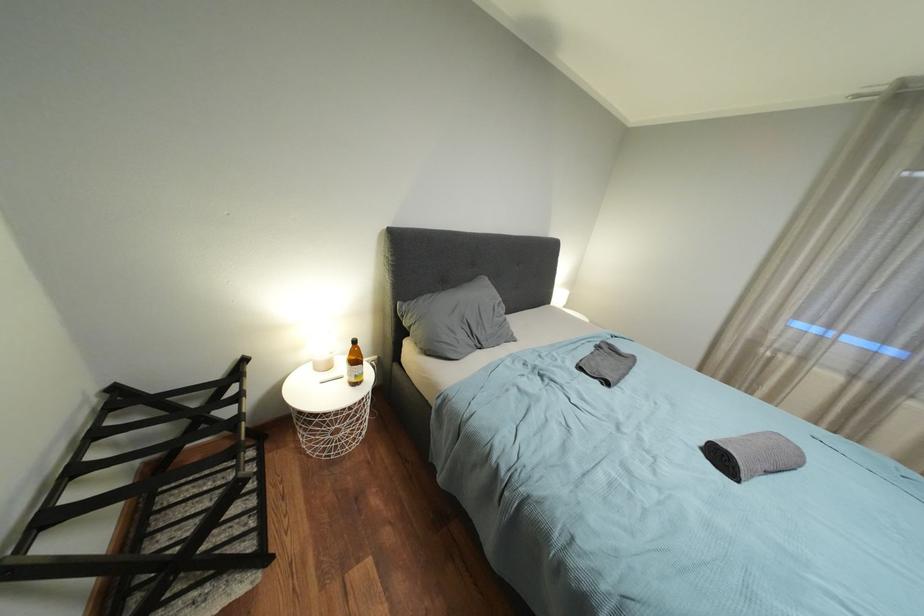
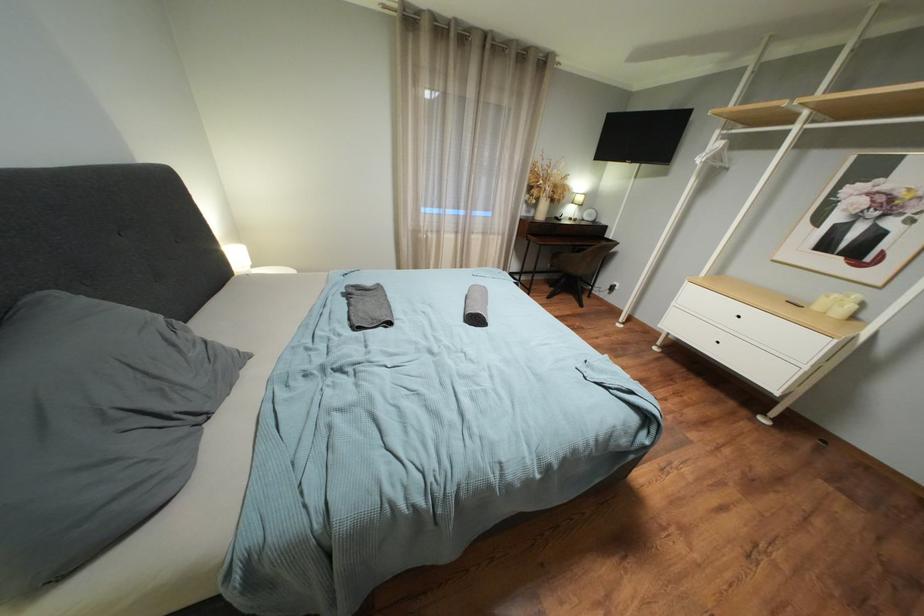
First-person continuous shooting, in which direction is the camera rotating?

The rotation direction of the camera is right-down.